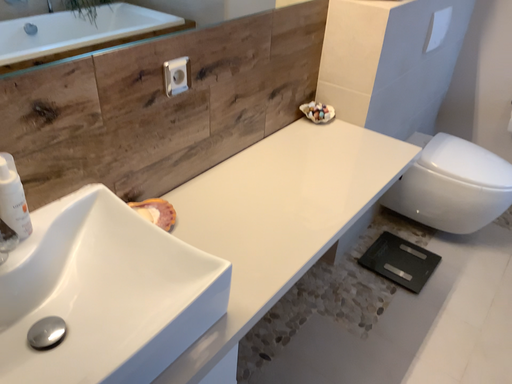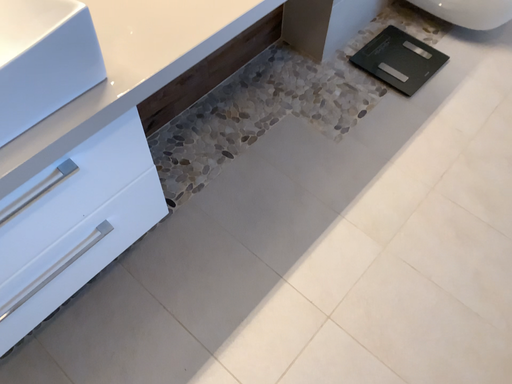
Question: Which way did the camera rotate in the video?

Choices:
 (A) rotated upward
 (B) rotated downward

Answer: (B)